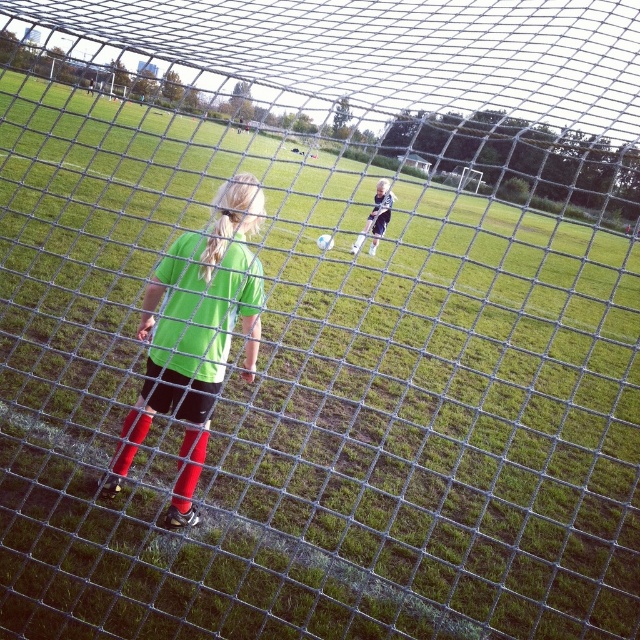
You are a soccer coach observing a practice session. You notice two players wearing the green matte shirt at center and the dark blue jersey at center. Which player is positioned closer to the left side of the field?

The green matte shirt at center is positioned to the left of the dark blue jersey at center, so the player in the green matte shirt at center is closer to the left side of the field.

You are a soccer coach analyzing the positions of two players during a game. The first player is at point (x=182, y=401) and the second is at point (x=380, y=227). Based on their positions, which player is closer to the goal net?

Point (x=182, y=401) is in front of point (x=380, y=227), so the first player at point (x=182, y=401) is closer to the goal net.